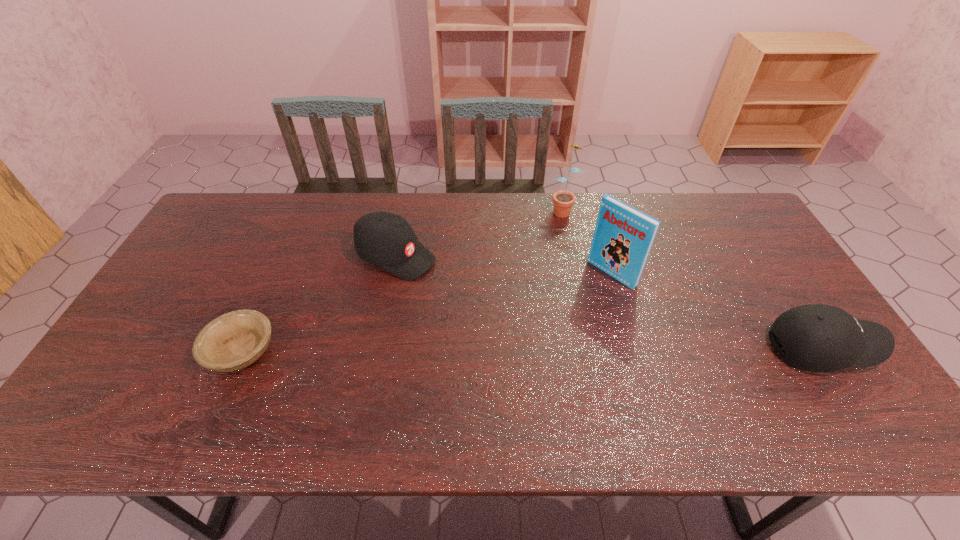
Locate an element on the screen. bowl present at the near edge is located at coordinates (233, 341).

At what (x,y) coordinates should I click in order to perform the action: click on baseball cap present at the near edge. Please return your answer as a coordinate pair (x, y). The height and width of the screenshot is (540, 960). Looking at the image, I should click on (817, 338).

Image resolution: width=960 pixels, height=540 pixels. In order to click on object present at the right edge in this screenshot , I will do [817, 338].

What are the coordinates of `object located at the near right corner` in the screenshot? It's located at (817, 338).

The height and width of the screenshot is (540, 960). In order to click on vacant area at the far edge of the desktop in this screenshot , I will do [439, 219].

Where is `free space at the near edge of the desktop`? free space at the near edge of the desktop is located at coordinates (521, 376).

Locate an element on the screen. vacant position at the right edge of the desktop is located at coordinates (746, 282).

At what (x,y) coordinates should I click in order to perform the action: click on free space at the far left corner of the desktop. Please return your answer as a coordinate pair (x, y). Image resolution: width=960 pixels, height=540 pixels. Looking at the image, I should click on (265, 201).

The image size is (960, 540). I want to click on free space at the far right corner, so click(x=736, y=203).

You are a GUI agent. You are given a task and a screenshot of the screen. Output one action in this format:
    pyautogui.click(x=<x>, y=<y>)
    Task: Click on the free space between the leftmost object and the book
    The height and width of the screenshot is (540, 960).
    Given the screenshot: What is the action you would take?
    pyautogui.click(x=426, y=313)